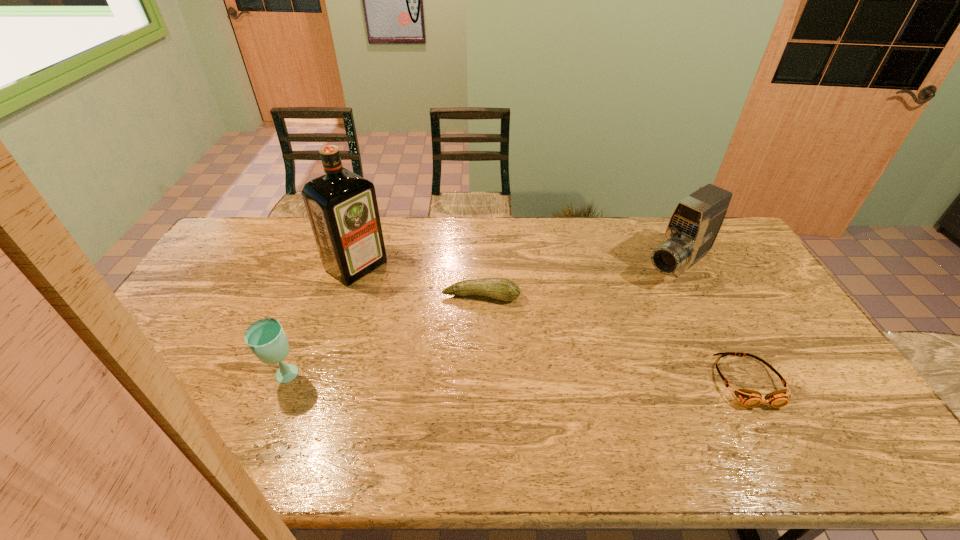
Locate an element on the screen. This screenshot has height=540, width=960. object that is positioned at the far right corner is located at coordinates (694, 224).

This screenshot has width=960, height=540. I want to click on free space at the far edge, so click(660, 225).

Locate an element on the screen. Image resolution: width=960 pixels, height=540 pixels. vacant area at the near edge of the desktop is located at coordinates (387, 397).

The image size is (960, 540). In order to click on free point at the right edge in this screenshot , I will do `click(762, 319)`.

In the image, there is a desktop. Identify the location of vacant space at the far left corner. The height and width of the screenshot is (540, 960). (265, 217).

This screenshot has height=540, width=960. Find the location of `free space at the near left corner of the desktop`. free space at the near left corner of the desktop is located at coordinates (115, 398).

Locate an element on the screen. Image resolution: width=960 pixels, height=540 pixels. vacant space that is in between the second tallest object and the third shortest object is located at coordinates coord(481,321).

The width and height of the screenshot is (960, 540). Find the location of `vacant area that lies between the goggles and the glass`. vacant area that lies between the goggles and the glass is located at coordinates (516, 379).

Where is `free area in between the shortest object and the zucchini`? The height and width of the screenshot is (540, 960). free area in between the shortest object and the zucchini is located at coordinates (614, 339).

You are a GUI agent. You are given a task and a screenshot of the screen. Output one action in this format:
    pyautogui.click(x=<x>, y=<y>)
    Task: Click on the empty space between the zucchini and the goggles
    This screenshot has width=960, height=540.
    Given the screenshot: What is the action you would take?
    pyautogui.click(x=614, y=339)